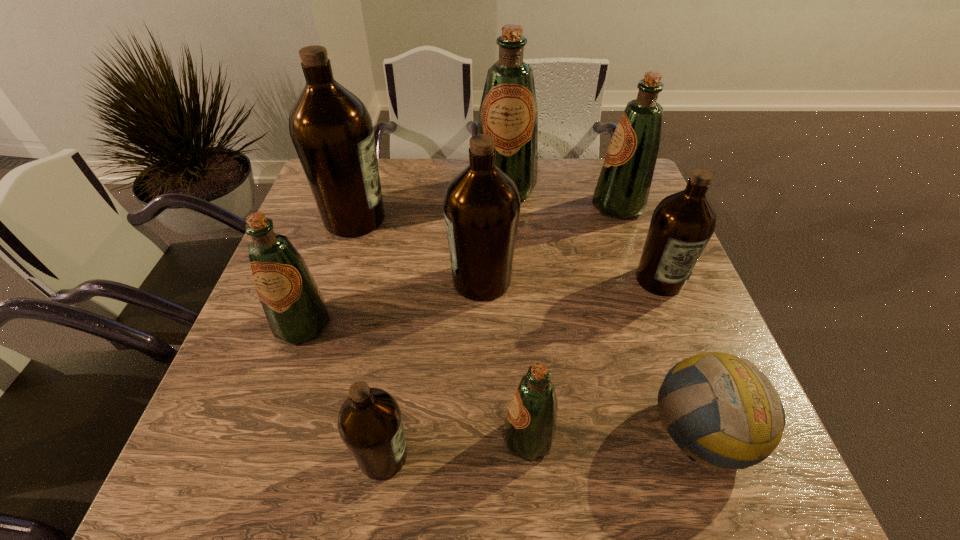
Identify the location of vacant space that is in between the farthest brown olive oil and the biggest green olive oil. Image resolution: width=960 pixels, height=540 pixels. (430, 204).

Where is `free space that is in between the leftmost green olive oil and the second smallest brown olive oil`? free space that is in between the leftmost green olive oil and the second smallest brown olive oil is located at coordinates (481, 302).

I want to click on free area in between the biggest brown olive oil and the leftmost green olive oil, so click(329, 272).

At what (x,y) coordinates should I click in order to perform the action: click on empty space between the biggest green olive oil and the second biggest green olive oil. Please return your answer as a coordinate pair (x, y). This screenshot has width=960, height=540. Looking at the image, I should click on tap(562, 198).

You are a GUI agent. You are given a task and a screenshot of the screen. Output one action in this format:
    pyautogui.click(x=<x>, y=<y>)
    Task: Click on the vacant area that lies between the second biggest brown olive oil and the volleyball
    The image size is (960, 540).
    Given the screenshot: What is the action you would take?
    (592, 355)

The image size is (960, 540). I want to click on vacant space in between the nearest green olive oil and the smallest brown olive oil, so click(x=456, y=447).

You are a GUI agent. You are given a task and a screenshot of the screen. Output one action in this format:
    pyautogui.click(x=<x>, y=<y>)
    Task: Click on the vacant space in between the third brown olive oil from right to left and the smallest green olive oil
    Image resolution: width=960 pixels, height=540 pixels.
    Given the screenshot: What is the action you would take?
    pyautogui.click(x=456, y=447)

I want to click on object that stands as the fifth closest to the leftmost brown olive oil, so click(x=530, y=425).

Locate an element on the screen. This screenshot has width=960, height=540. object that can be found as the second closest to the smallest green olive oil is located at coordinates (742, 419).

The height and width of the screenshot is (540, 960). Find the location of `olive oil that stands as the closest to the rightmost green olive oil`. olive oil that stands as the closest to the rightmost green olive oil is located at coordinates (508, 112).